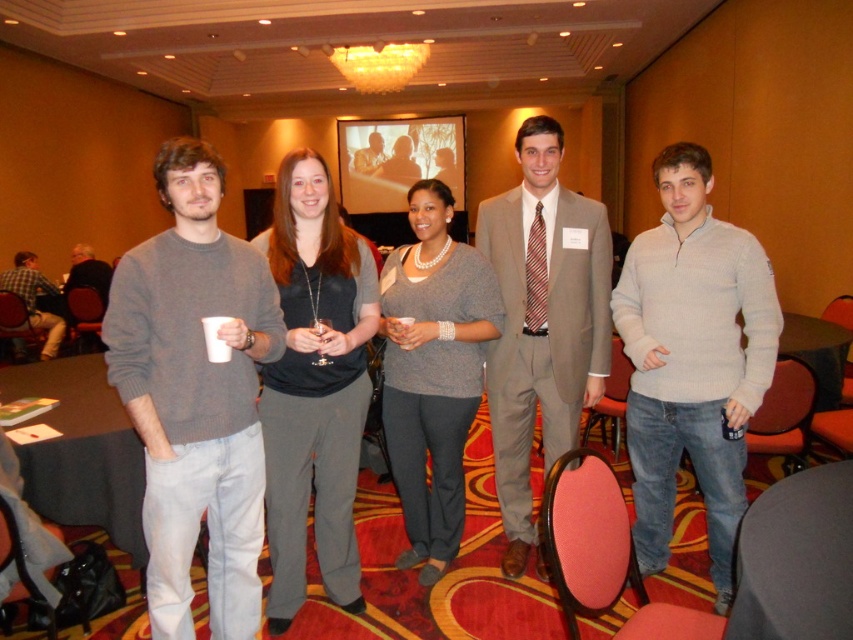
Is point (190, 625) farther from camera compared to point (55, 342)?

No, it is in front of (55, 342).

Consider the image. Does matte gray sweater at center have a larger size compared to plaid cotton shirt at left?

No, matte gray sweater at center is not bigger than plaid cotton shirt at left.

Who is more distant from viewer, (169, 564) or (27, 266)?

Point (27, 266)

You are a GUI agent. You are given a task and a screenshot of the screen. Output one action in this format:
    pyautogui.click(x=<x>, y=<y>)
    Task: Click on the matte gray sweater at center
    The image size is (853, 640).
    Given the screenshot: What is the action you would take?
    pyautogui.click(x=195, y=394)

Who is positioned more to the right, matte gray pants at center or dark gray fabric table at lower left?

matte gray pants at center

Is point (274, 364) positioned behind point (135, 481)?

No, (274, 364) is in front of (135, 481).

The height and width of the screenshot is (640, 853). In order to click on matte gray pants at center in this screenshot , I will do `click(314, 387)`.

Can you confirm if matte gray sweater at center is positioned below gray sweater at center?

Yes, matte gray sweater at center is below gray sweater at center.

Locate an element on the screen. The width and height of the screenshot is (853, 640). matte gray sweater at center is located at coordinates (195, 394).